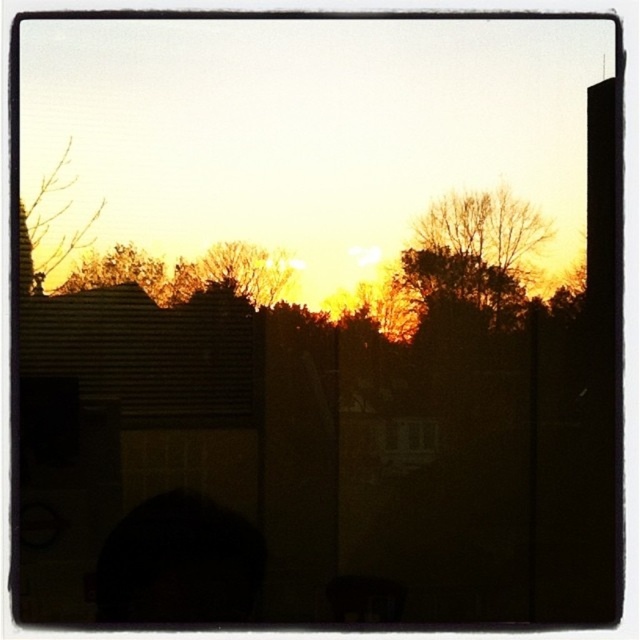
You are an architect designing a new garden and want to place a small statue between the bare branches at upper left and the brown textured tree at upper left. Given that the statue requires 3 inches of space to fit comfortably, will there be enough space between them?

The distance between the bare branches at upper left and the brown textured tree at upper left is 2.75 inches, which is less than the required 3 inches. Therefore, the statue will not fit comfortably between them.